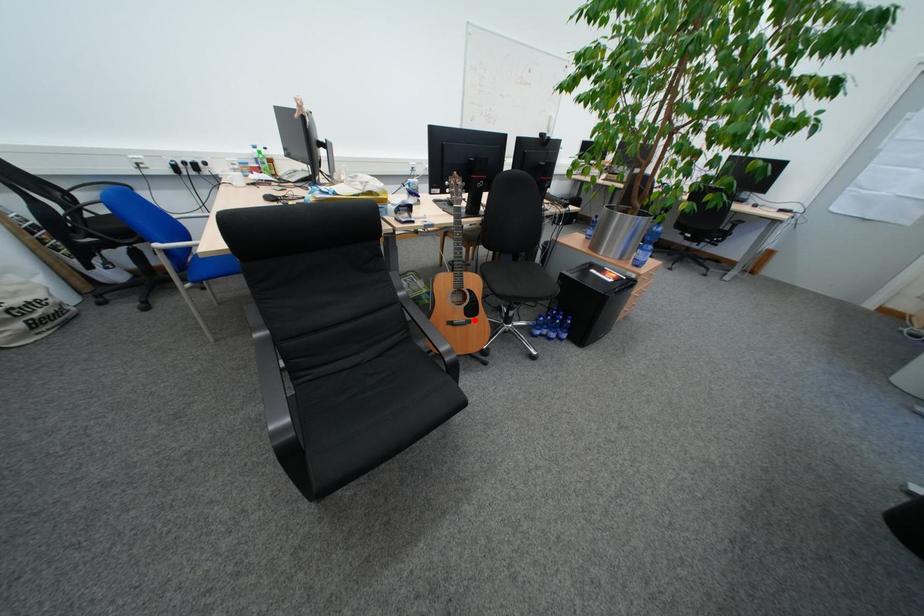
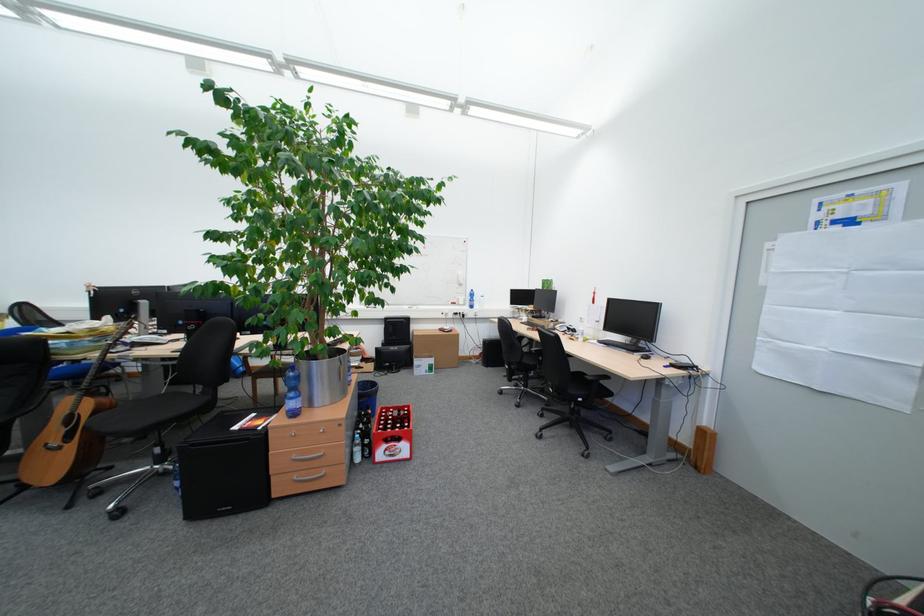
Question: A red point is marked in image1. In image2, is the corresponding 3D point closer to the camera or farther? Reply with the corresponding letter.

Choices:
 (A) The corresponding 3D point is closer.
 (B) The corresponding 3D point is farther.

Answer: (A)